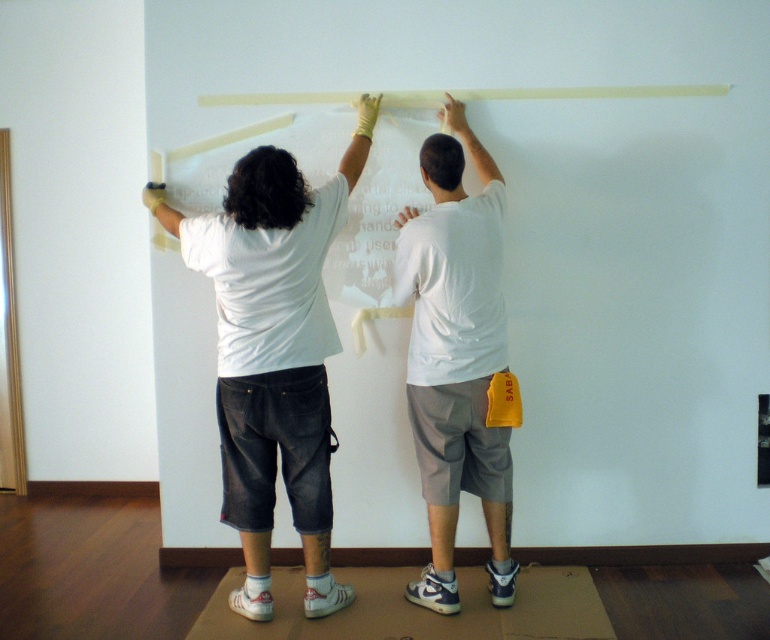
Question: Is white matte t-shirt at center bigger than white matte t-shirt at upper center?

Choices:
 (A) yes
 (B) no

Answer: (A)

Question: Which point is closer to the camera?

Choices:
 (A) pyautogui.click(x=581, y=97)
 (B) pyautogui.click(x=313, y=477)
 (C) pyautogui.click(x=422, y=154)

Answer: (B)

Question: Does white matte t-shirt at center have a lesser width compared to white matte t-shirt at upper center?

Choices:
 (A) no
 (B) yes

Answer: (A)

Question: Among these points, which one is nearest to the camera?

Choices:
 (A) [x=487, y=97]
 (B) [x=484, y=228]
 (C) [x=367, y=99]

Answer: (B)

Question: Is white matte t-shirt at center wider than translucent plastic tape at upper center?

Choices:
 (A) no
 (B) yes

Answer: (A)

Question: Among these points, which one is nearest to the camera?

Choices:
 (A) (240, 104)
 (B) (429, 301)

Answer: (B)